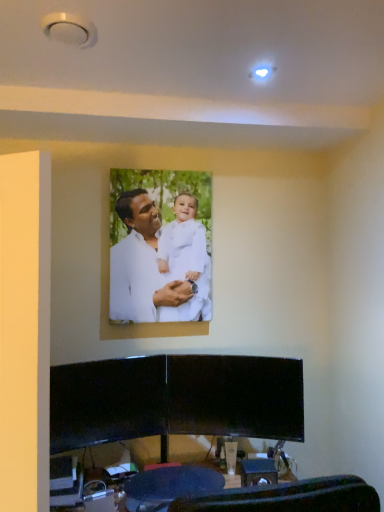
Question: From the image's perspective, relative to white matte/soft fabric man at center, is black glossy entertainment center at lower center above or below?

Choices:
 (A) above
 (B) below

Answer: (B)

Question: Is black glossy entertainment center at lower center wider or thinner than white matte/soft fabric man at center?

Choices:
 (A) thin
 (B) wide

Answer: (B)

Question: Estimate the real-world distances between objects in this image. Which object is closer to the black glossy entertainment center at lower center?

Choices:
 (A) dark blue fabric swivel chair at lower center
 (B) white matte/soft fabric man at center

Answer: (A)

Question: Which of these objects is positioned farthest from the dark blue fabric swivel chair at lower center?

Choices:
 (A) white matte/soft fabric man at center
 (B) black glossy entertainment center at lower center

Answer: (A)